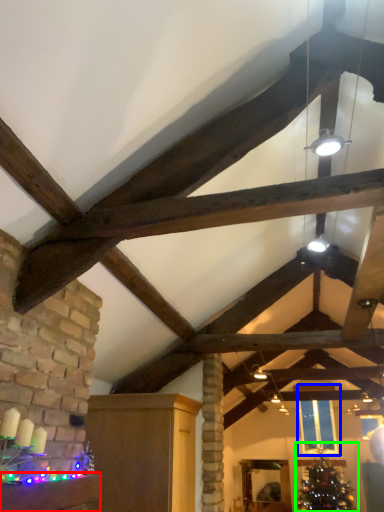
Question: Estimate the real-world distances between objects in this image. Which object is closer to furniture (highlighted by a red box), window (highlighted by a blue box) or christmas tree (highlighted by a green box)?

Choices:
 (A) window
 (B) christmas tree

Answer: (A)